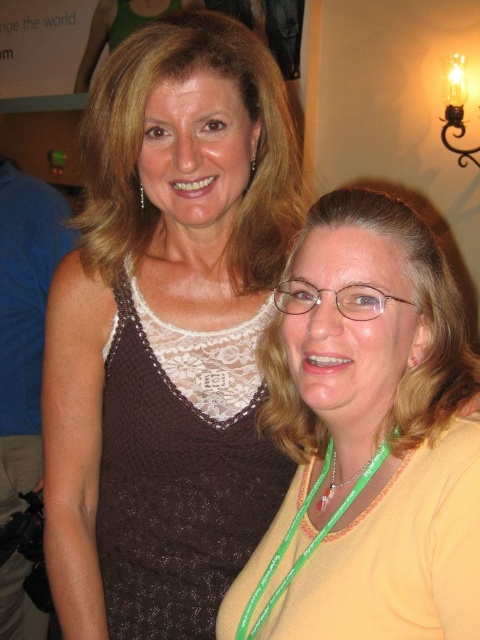
Which of these two, brown lace tank top at upper left or yellow fabric at center, stands taller?

brown lace tank top at upper left is taller.

Is point (264, 296) behind point (464, 428)?

Yes, it is.

Where is `brown lace tank top at upper left`? The width and height of the screenshot is (480, 640). brown lace tank top at upper left is located at coordinates (167, 332).

Is brown lace tank top at upper left above brown knitted dress at left?

Indeed, brown lace tank top at upper left is positioned over brown knitted dress at left.

Which is behind, point (213, 608) or point (11, 172)?

The point (11, 172) is behind.

Is point (175, 524) positioned in front of point (38, 438)?

Yes, point (175, 524) is closer to viewer.

This screenshot has height=640, width=480. What are the coordinates of `brown lace tank top at upper left` in the screenshot? It's located at (167, 332).

Does yellow fabric at center appear on the right side of brown knitted dress at left?

Indeed, yellow fabric at center is positioned on the right side of brown knitted dress at left.

Is point (360, 278) in front of point (21, 474)?

Yes, point (360, 278) is closer to viewer.

You are a GUI agent. You are given a task and a screenshot of the screen. Output one action in this format:
    pyautogui.click(x=<x>, y=<y>)
    Task: Click on the yellow fabric at center
    This screenshot has height=640, width=480.
    Given the screenshot: What is the action you would take?
    pyautogui.click(x=368, y=438)